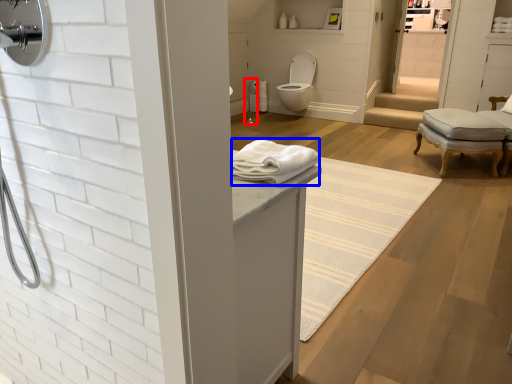
Question: Which object is further to the camera taking this photo, shower (highlighted by a red box) or bath towel (highlighted by a blue box)?

Choices:
 (A) shower
 (B) bath towel

Answer: (A)